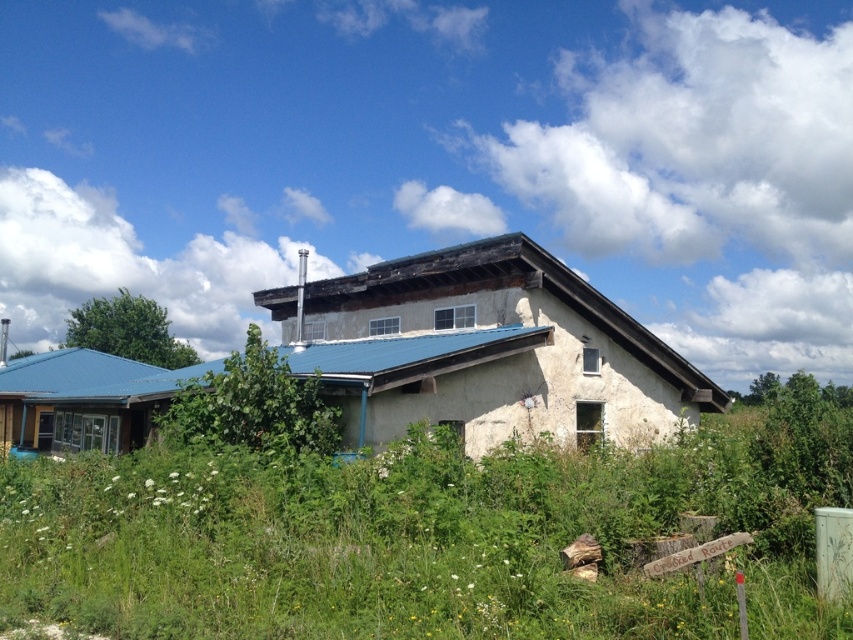
You are standing outside the rustic building and want to take a photo of both the stucco house at center and the matte blue siding at left. Which object should you focus on first to ensure both are in frame?

The stucco house at center is positioned over the matte blue siding at left, so you should focus on the stucco house at center first to ensure both are in frame.